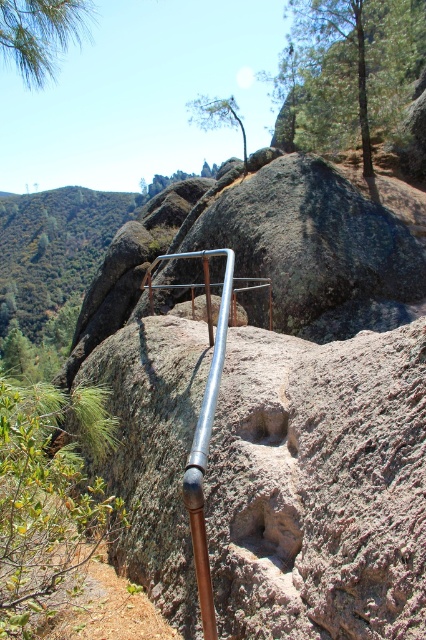
In the scene shown: You are a hiker standing on the trail and see the smooth granite boulder at center and the silver metallic pipe at center. Which object is closer to the left side of the trail?

The smooth granite boulder at center is to the left of the silver metallic pipe at center, so it is closer to the left side of the trail.

You are a hiker standing on the trail and see the smooth granite boulder at center and the silver metallic pipe at center. Which object is nearer to you?

The smooth granite boulder at center is closer to the viewer than the silver metallic pipe at center.